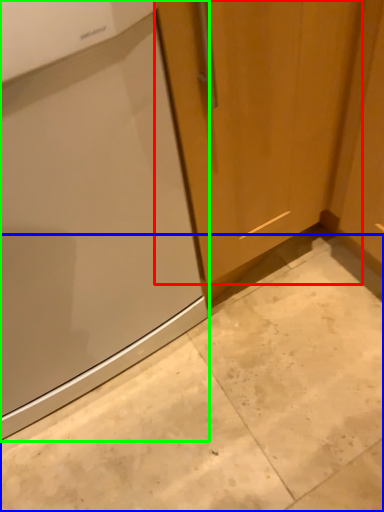
Question: Based on their relative distances, which object is farther from door (highlighted by a red box)? Choose from concrete (highlighted by a blue box) and home appliance (highlighted by a green box).

Choices:
 (A) concrete
 (B) home appliance

Answer: (A)